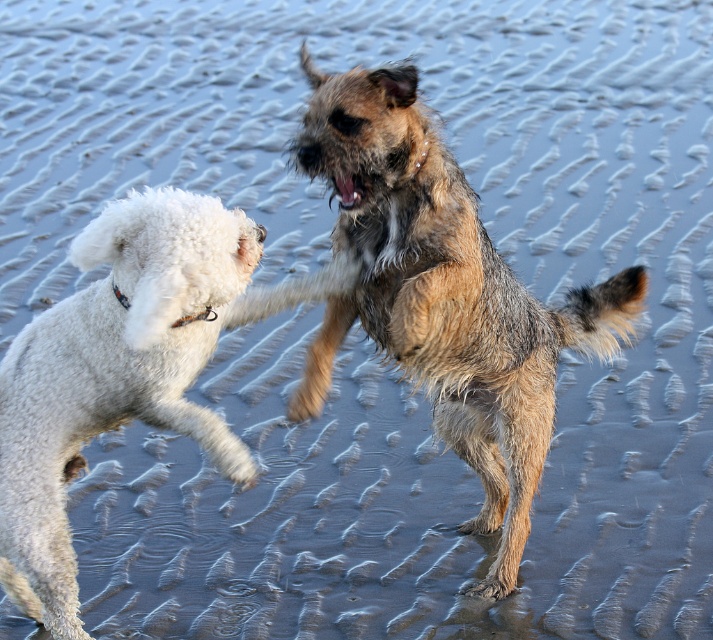
Which is in front, point (574, 301) or point (178, 304)?

Positioned in front is point (178, 304).

Between shaggy brown dog at center and white fluffy dog at left, which one is positioned higher?

shaggy brown dog at center is above.

Which is behind, point (438, 184) or point (56, 456)?

Positioned behind is point (438, 184).

At what (x,y) coordinates should I click in order to perform the action: click on shaggy brown dog at center. Please return your answer as a coordinate pair (x, y). Looking at the image, I should click on (443, 294).